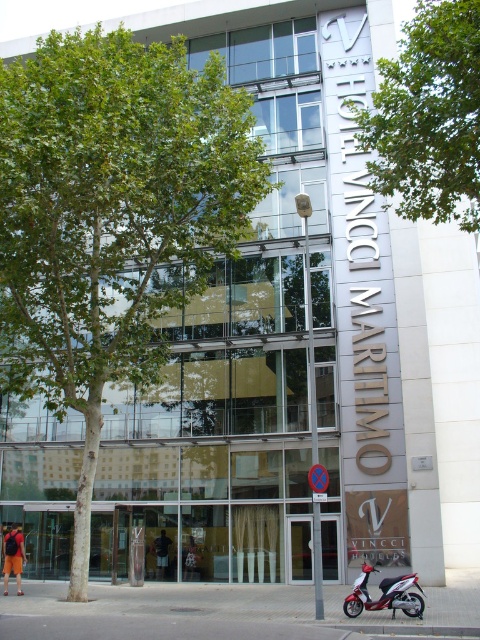
Who is more distant from viewer, [85,128] or [360,586]?

The point [85,128] is more distant.

What do you see at coordinates (110, 218) in the screenshot? I see `green leafy tree at center` at bounding box center [110, 218].

I want to click on green leafy tree at center, so click(110, 218).

Based on the photo, can you confirm if green leafy tree at upper center is smaller than metallic red scooter at lower right?

Actually, green leafy tree at upper center might be larger than metallic red scooter at lower right.

Does green leafy tree at upper center come in front of metallic red scooter at lower right?

Yes, it is.

Who is more distant from viewer, (450, 125) or (367, 582)?

Point (367, 582)

I want to click on green leafy tree at upper center, so click(x=429, y=116).

Does point (19, 97) come closer to viewer compared to point (423, 182)?

Yes, it is in front of point (423, 182).

Which of these two, green leafy tree at center or green leafy tree at upper center, stands shorter?

With less height is green leafy tree at upper center.

Is point (132, 67) more distant than point (420, 74)?

Yes, point (132, 67) is farther from viewer.

What are the coordinates of `green leafy tree at center` in the screenshot? It's located at (110, 218).